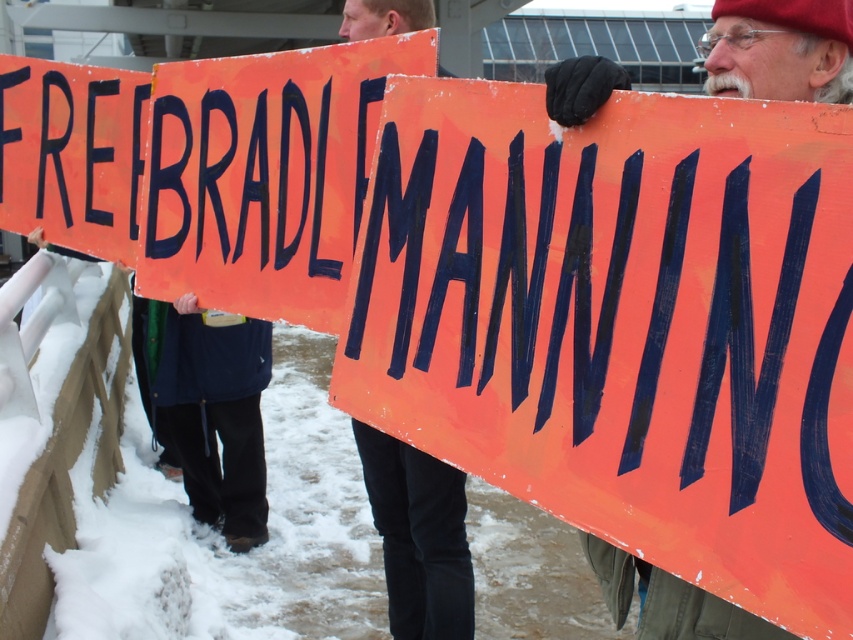
Question: Is orange painted wood sign at center thinner than orange painted wood sign at upper left?

Choices:
 (A) no
 (B) yes

Answer: (A)

Question: Which object is the closest to the matte orange sign at center?

Choices:
 (A) dark blue fleece pants at lower left
 (B) orange painted wood sign at upper left

Answer: (B)

Question: Can you confirm if orange painted wood sign at upper left is bigger than matte orange sign at center?

Choices:
 (A) no
 (B) yes

Answer: (B)

Question: Estimate the real-world distances between objects in this image. Which object is farther from the matte orange sign at center?

Choices:
 (A) dark blue fleece pants at lower left
 (B) orange painted wood sign at center
 (C) orange painted wood sign at upper left

Answer: (A)

Question: Considering the relative positions of dark blue fleece pants at lower left and matte orange sign at center in the image provided, where is dark blue fleece pants at lower left located with respect to matte orange sign at center?

Choices:
 (A) above
 (B) below

Answer: (B)

Question: Which of the following is the closest to the observer?

Choices:
 (A) dark blue fleece pants at lower left
 (B) orange painted wood sign at center

Answer: (B)